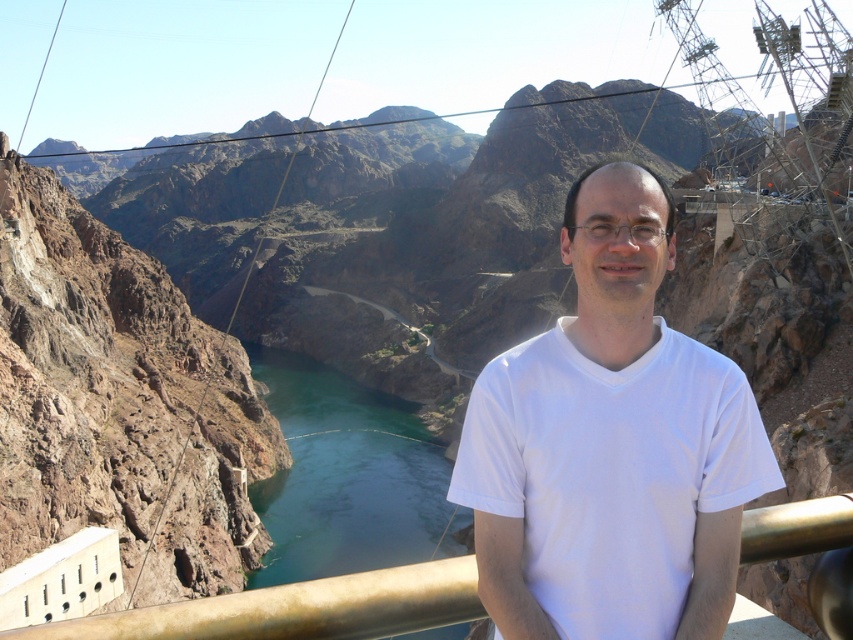
You are a photographer trying to capture a wide shot of the scenic view. You notice the white matte shirt at center and the gold metallic railing at center in your frame. Which object should you adjust your camera to focus on if you want to highlight the narrower object?

The white matte shirt at center has a lesser width compared to the gold metallic railing at center, so you should focus on the white matte shirt at center to highlight the narrower object.